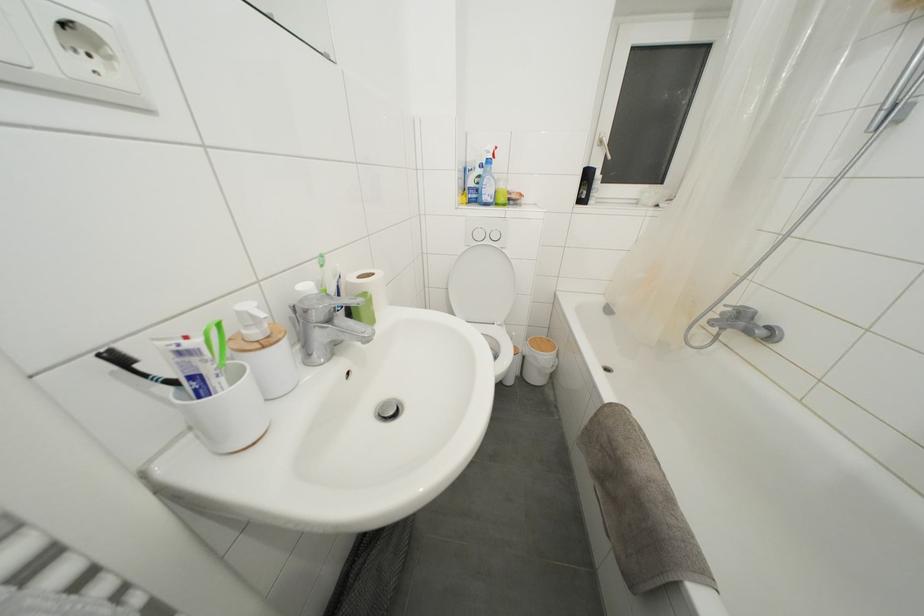
In order to click on white electrical socket in this screenshot , I will do `click(84, 49)`.